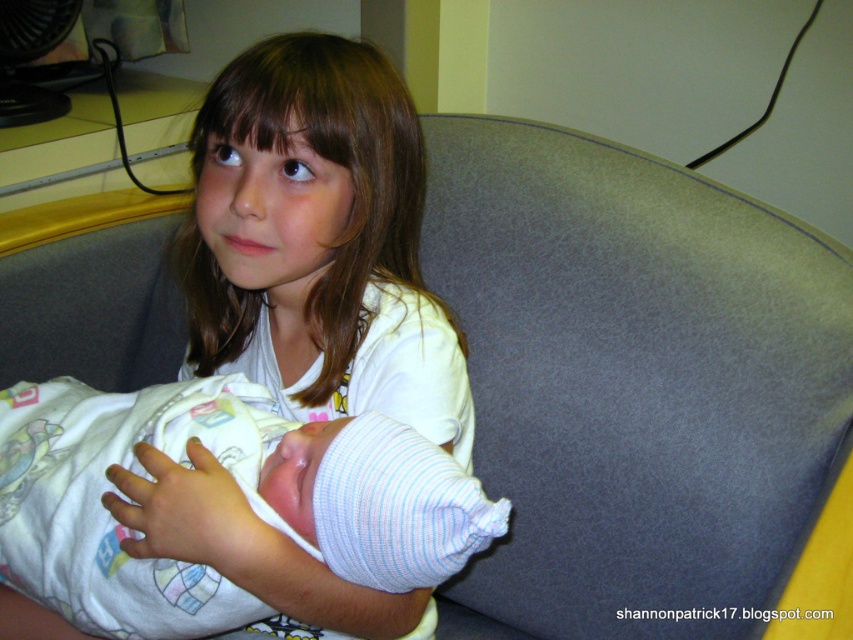
In the scene shown: You are a photographer setting up for a portrait. You have two points marked in the image for focus adjustments. The first point is at coordinate point (302, 612) and the second at point (202, 449). Which point should you focus on to ensure the subject closest to the viewer is in sharp focus?

Point (302, 612) is closer to the viewer than point (202, 449), so focusing on point (302, 612) will ensure the subject closest to the viewer is in sharp focus.

Based on the scene description, which object is taller between the white soft shirt at center and the white striped fabric at center?

The white soft shirt at center is much taller than the white striped fabric at center.

You are a photographer trying to capture a closeup shot of the newborn baby in the image. You notice two white items at the center of the scene. Which item is wider, the white soft shirt at center or the white striped fabric at center?

The white soft shirt at center is wider than the white striped fabric at center according to the description.